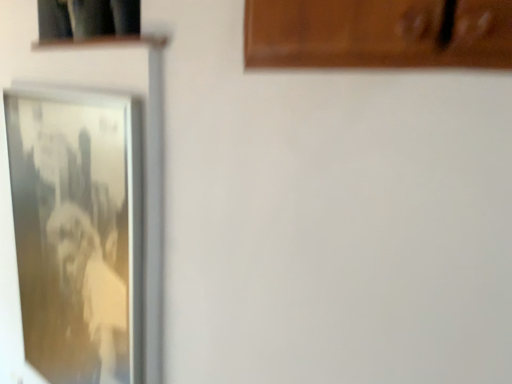
You are a GUI agent. You are given a task and a screenshot of the screen. Output one action in this format:
    pyautogui.click(x=<x>, y=<y>)
    Task: Click on the metallic silver frame at left
    This screenshot has width=512, height=384.
    Given the screenshot: What is the action you would take?
    pyautogui.click(x=78, y=231)

Image resolution: width=512 pixels, height=384 pixels. What do you see at coordinates (78, 231) in the screenshot?
I see `metallic silver frame at left` at bounding box center [78, 231].

Where is `metallic silver frame at left`? The height and width of the screenshot is (384, 512). metallic silver frame at left is located at coordinates (78, 231).